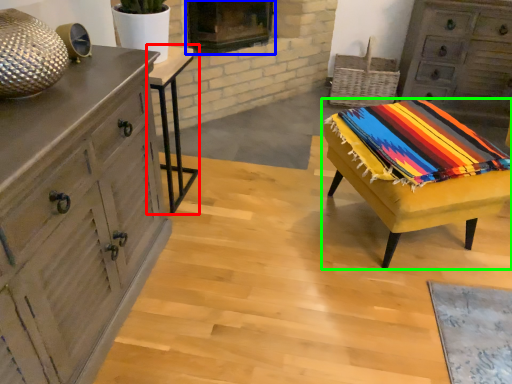
Question: Which is nearer to the table (highlighted by a red box)? fireplace (highlighted by a blue box) or table (highlighted by a green box).

Choices:
 (A) fireplace
 (B) table

Answer: (A)